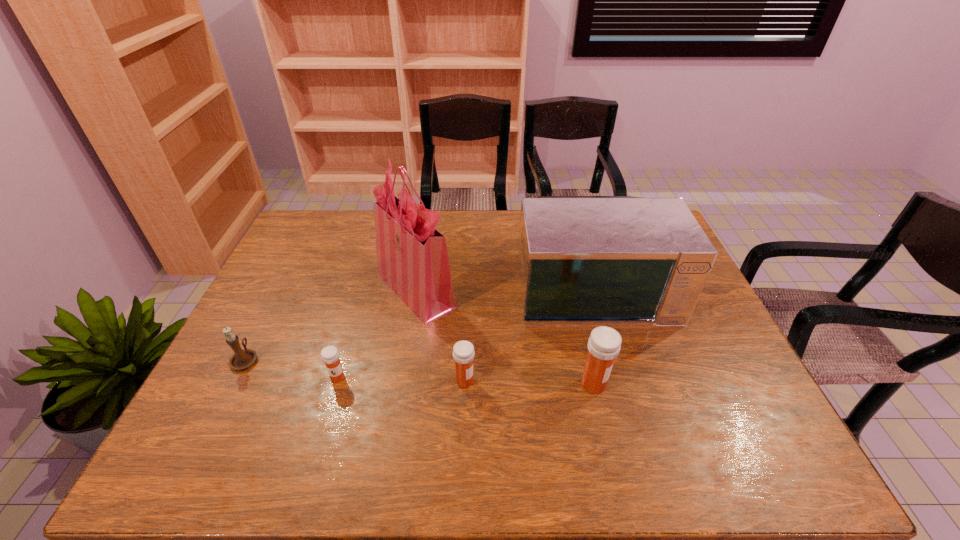
The width and height of the screenshot is (960, 540). Identify the location of vacant space that is in between the rightmost medicine and the tallest object. (505, 337).

Where is `unoccupied position between the leftmost medicine and the candle holder`? This screenshot has height=540, width=960. unoccupied position between the leftmost medicine and the candle holder is located at coordinates (291, 368).

The height and width of the screenshot is (540, 960). In order to click on free space between the fourth object from left to right and the shopping bag in this screenshot , I will do `click(441, 335)`.

Locate an element on the screen. vacant area that lies between the leftmost medicine and the candle holder is located at coordinates (291, 368).

The width and height of the screenshot is (960, 540). Find the location of `vacant space that is in between the tallest medicine and the shopping bag`. vacant space that is in between the tallest medicine and the shopping bag is located at coordinates (505, 337).

Where is `free space between the candle holder and the second tallest medicine`? free space between the candle holder and the second tallest medicine is located at coordinates (355, 370).

Where is `object that can be found as the second closest to the third object from left to right`? object that can be found as the second closest to the third object from left to right is located at coordinates (463, 351).

Locate an element on the screen. object that is the third closest to the second tallest object is located at coordinates (463, 351).

Locate which medicine ranks third in proximity to the fifth shortest object. Please provide its 2D coordinates. Your answer should be formatted as a tuple, i.e. [(x, y)], where the tuple contains the x and y coordinates of a point satisfying the conditions above.

[(330, 356)]

Locate which medicine is the third closest to the candle holder. Please provide its 2D coordinates. Your answer should be formatted as a tuple, i.e. [(x, y)], where the tuple contains the x and y coordinates of a point satisfying the conditions above.

[(604, 344)]